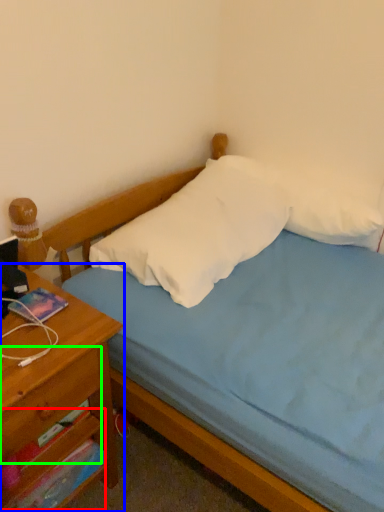
Question: Which is farther away from drawer (highlighted by a red box)? nightstand (highlighted by a blue box) or drawer (highlighted by a green box)?

Choices:
 (A) nightstand
 (B) drawer

Answer: (B)